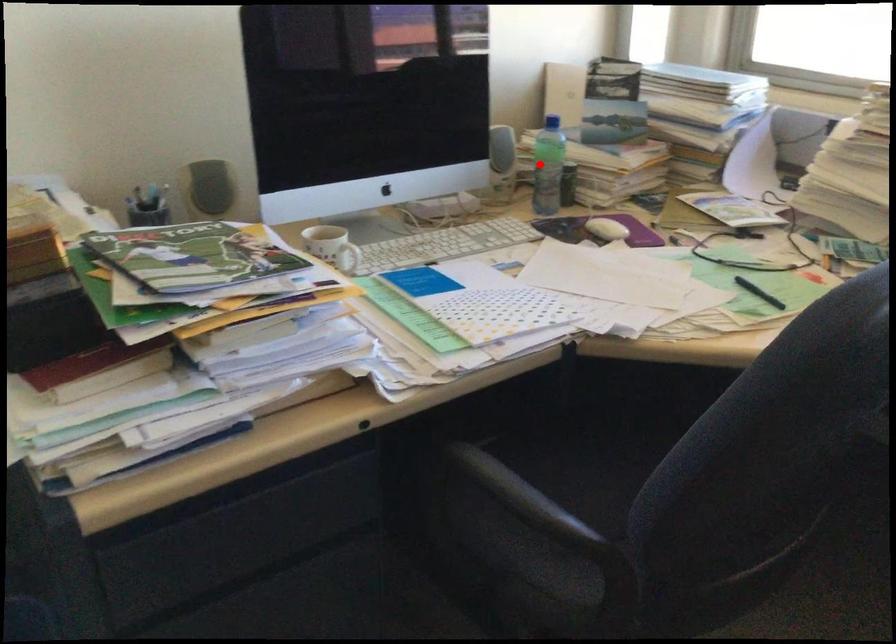
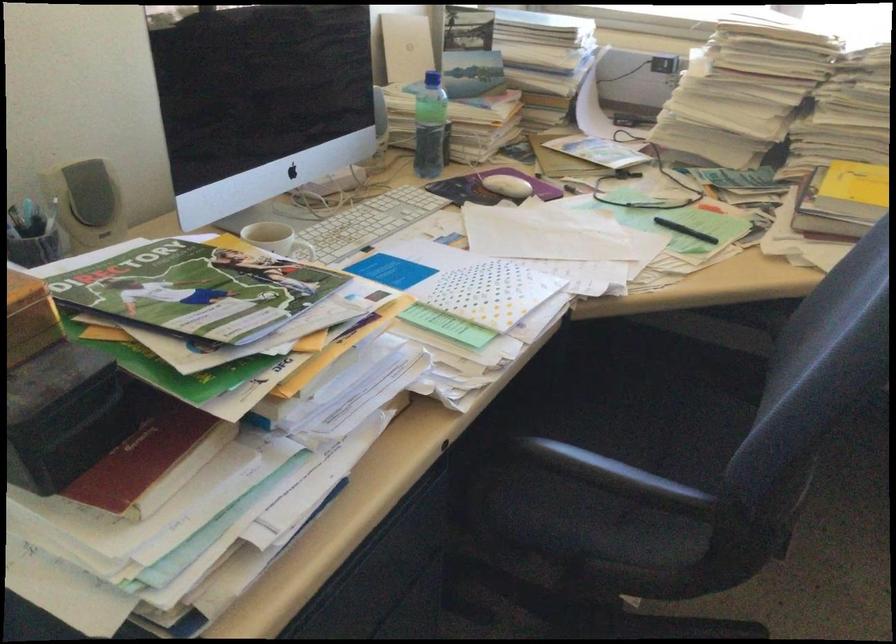
Where in the second image is the point corresponding to the highlighted location from the first image?

(428, 126)